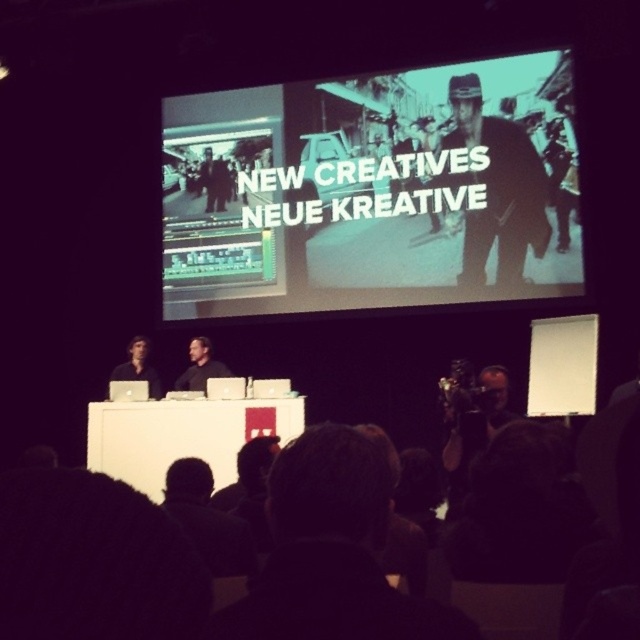
Question: Which object appears farthest from the camera in this image?

Choices:
 (A) black shirt at center
 (B) dark textured jacket at upper right
 (C) matte black laptop at left
 (D) teal matte projection screen at center

Answer: (A)

Question: From the image, what is the correct spatial relationship of teal matte projection screen at center in relation to dark textured jacket at upper right?

Choices:
 (A) below
 (B) above

Answer: (A)

Question: Which point is farther from the camera taking this photo?

Choices:
 (A) (472, 216)
 (B) (120, 371)

Answer: (B)

Question: Which point is closer to the camera?

Choices:
 (A) (460, 81)
 (B) (195, 372)
 (C) (157, 380)
 (D) (188, 189)

Answer: (A)

Question: Does teal matte projection screen at center lie in front of matte black laptop at left?

Choices:
 (A) no
 (B) yes

Answer: (B)

Question: Is black shirt at center smaller than matte black laptop at left?

Choices:
 (A) yes
 (B) no

Answer: (A)